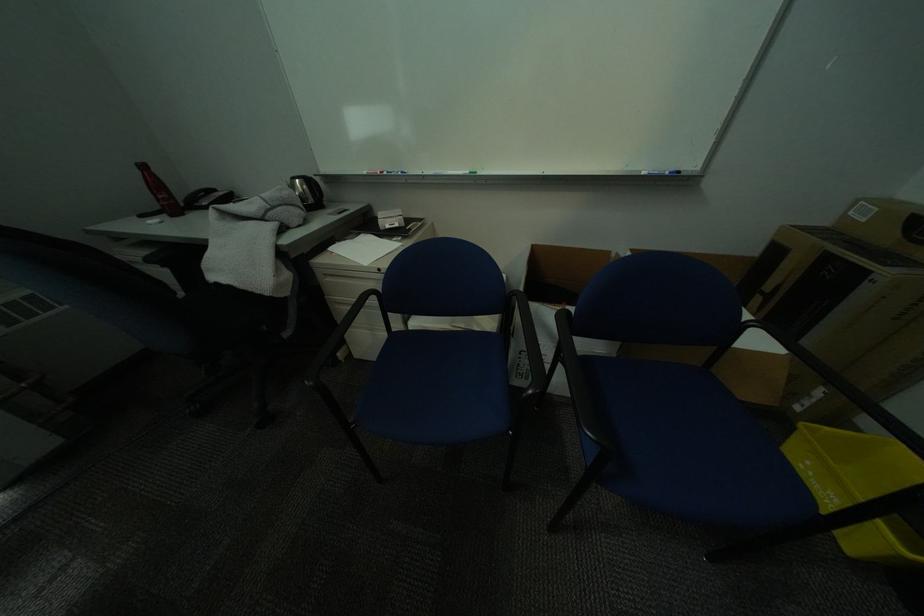
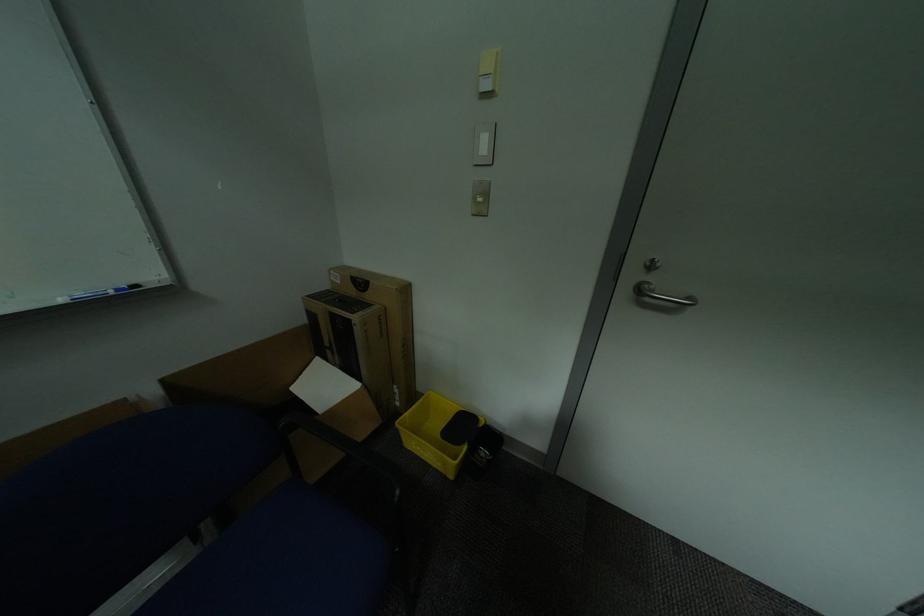
Question: Based on the continuous images, in which direction is the camera rotating? Reply with the corresponding letter.

Choices:
 (A) Left
 (B) Right
 (C) Up
 (D) Down

Answer: (B)